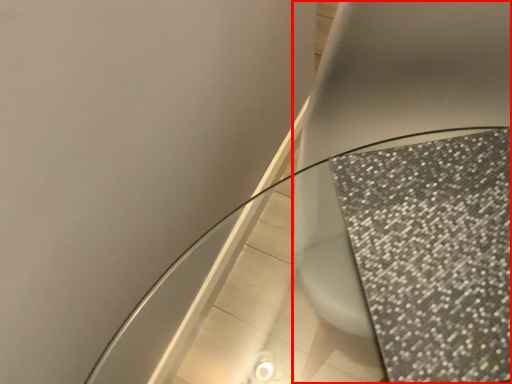
Question: Where is toilet (annotated by the red box) located in relation to round table in the image?

Choices:
 (A) right
 (B) left

Answer: (A)